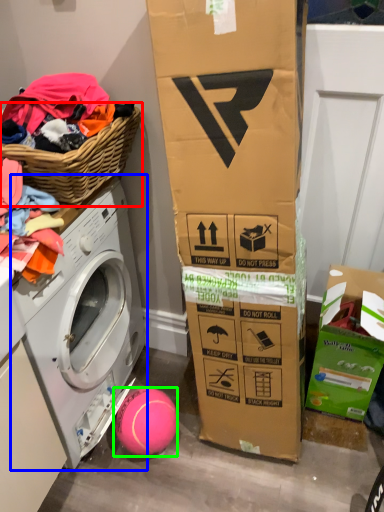
Question: Considering the real-world distances, which object is closest to basket (highlighted by a red box)? washing machine (highlighted by a blue box) or ball (highlighted by a green box).

Choices:
 (A) washing machine
 (B) ball

Answer: (A)